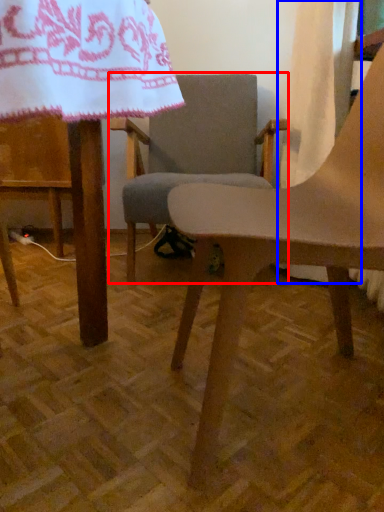
Question: Which object is further to the camera taking this photo, chair (highlighted by a red box) or curtain (highlighted by a blue box)?

Choices:
 (A) chair
 (B) curtain

Answer: (A)